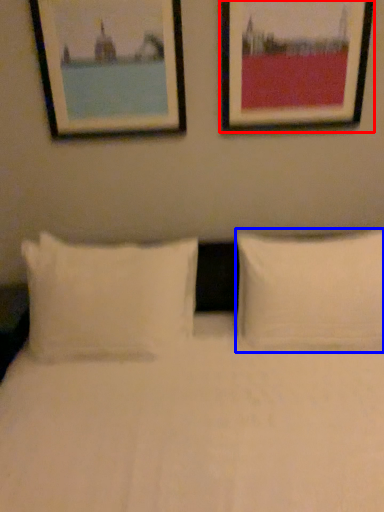
Question: Which of the following is the farthest to the observer, picture frame (highlighted by a red box) or pillow (highlighted by a blue box)?

Choices:
 (A) picture frame
 (B) pillow

Answer: (A)